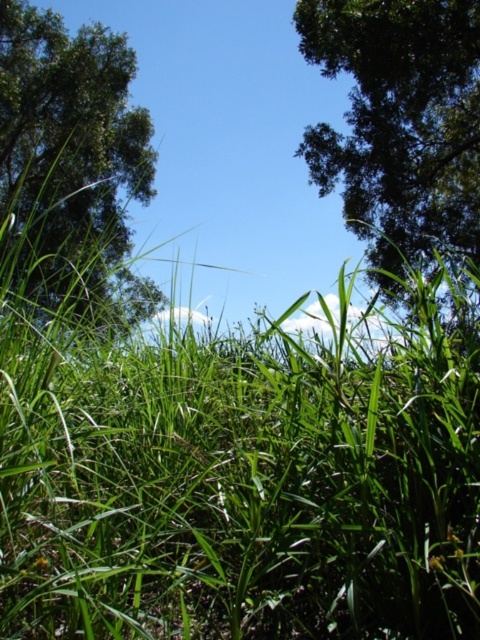
Question: Does green leafy tree at upper right appear under green leafy tree at upper left?

Choices:
 (A) no
 (B) yes

Answer: (A)

Question: Does green leafy tree at upper right have a smaller size compared to green leafy tree at upper left?

Choices:
 (A) yes
 (B) no

Answer: (A)

Question: Among these points, which one is farthest from the camera?

Choices:
 (A) (373, 61)
 (B) (57, 189)

Answer: (B)

Question: Is green leafy tree at upper right positioned behind green leafy tree at upper left?

Choices:
 (A) no
 (B) yes

Answer: (B)